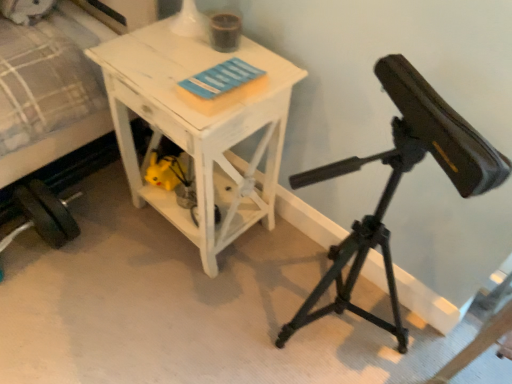
In order to face black matte tripod at right, should I rotate leftwards or rightwards?

To align with it, rotate right about 15.893°.

Measure the distance between white distressed wood table at center and camera.

white distressed wood table at center is 1.00 meters away from camera.

Identify the location of black matte tripod at right. (397, 184).

Who is smaller, black matte tripod at right or white distressed wood table at center?

white distressed wood table at center is smaller.

Based on the photo, from a real-world perspective, relative to white distressed wood table at center, is black matte tripod at right vertically above or below?

In terms of real-world spatial position, black matte tripod at right is above white distressed wood table at center.

Based on the photo, which point is more forward, (475, 168) or (182, 221)?

The point (475, 168) is more forward.

Which object is positioned more to the left, white distressed wood table at center or white fabric bed at left?

Positioned to the left is white fabric bed at left.

Considering the relative sizes of white distressed wood table at center and white fabric bed at left in the image provided, is white distressed wood table at center taller than white fabric bed at left?

In fact, white distressed wood table at center may be shorter than white fabric bed at left.

How distant is white distressed wood table at center from white fabric bed at left?

The distance of white distressed wood table at center from white fabric bed at left is 14.22 inches.

Are white fabric bed at left and black matte tripod at right far apart?

They are positioned close to each other.

Between point (79, 43) and point (366, 246), which one is positioned in front?

The point (366, 246) is more forward.

Which of these two, white fabric bed at left or black matte tripod at right, is bigger?

white fabric bed at left.

Based on the photo, is black matte tripod at right aimed at white fabric bed at left?

No, black matte tripod at right is not aimed at white fabric bed at left.

Find the location of a particular element. Image resolution: width=512 pixels, height=384 pixels. bed that is on the left side of black matte tripod at right is located at coordinates click(49, 122).

Is black matte tripod at right taller than white fabric bed at left?

Indeed, black matte tripod at right has a greater height compared to white fabric bed at left.

Considering the relative positions of black matte tripod at right and white fabric bed at left in the image provided, is black matte tripod at right in front of white fabric bed at left?

Yes, black matte tripod at right is in front of white fabric bed at left.

Consider the image. How many degrees apart are the facing directions of white distressed wood table at center and black matte tripod at right?

The facing directions of white distressed wood table at center and black matte tripod at right are 0.000626 degrees apart.

Is point (176, 140) more distant than point (420, 148)?

That is True.

Which object is thinner, white distressed wood table at center or black matte tripod at right?

white distressed wood table at center.

Considering the relative sizes of white distressed wood table at center and black matte tripod at right in the image provided, is white distressed wood table at center bigger than black matte tripod at right?

No, white distressed wood table at center is not bigger than black matte tripod at right.

From the image's perspective, is white fabric bed at left under white distressed wood table at center?

No.

Is white fabric bed at left next to white distressed wood table at center?

white fabric bed at left and white distressed wood table at center are clearly separated.

Does white fabric bed at left contain white distressed wood table at center?

No.

Where is `table above the black matte tripod at right (from the image's perspective)`? The height and width of the screenshot is (384, 512). table above the black matte tripod at right (from the image's perspective) is located at coordinates pos(199,130).

The width and height of the screenshot is (512, 384). I want to click on table below the white fabric bed at left (from the image's perspective), so click(x=199, y=130).

Based on their spatial positions, is black matte tripod at right or white distressed wood table at center further from white fabric bed at left?

black matte tripod at right is positioned further to the anchor white fabric bed at left.

When comparing their distances from black matte tripod at right, does white distressed wood table at center or white fabric bed at left seem closer?

white distressed wood table at center is closer to black matte tripod at right.

From the image, which object appears to be farther from white distressed wood table at center, white fabric bed at left or black matte tripod at right?

Among the two, black matte tripod at right is located further to white distressed wood table at center.

Considering their positions, is white distressed wood table at center positioned further to white fabric bed at left than black matte tripod at right?

Among the two, black matte tripod at right is located further to white fabric bed at left.

Estimate the real-world distances between objects in this image. Which object is further from black matte tripod at right, white fabric bed at left or white distressed wood table at center?

Based on the image, white fabric bed at left appears to be further to black matte tripod at right.

Considering their positions, is black matte tripod at right positioned closer to white distressed wood table at center than white fabric bed at left?

The object closer to white distressed wood table at center is white fabric bed at left.

Locate an element on the screen. The width and height of the screenshot is (512, 384). table between white fabric bed at left and black matte tripod at right is located at coordinates (199, 130).